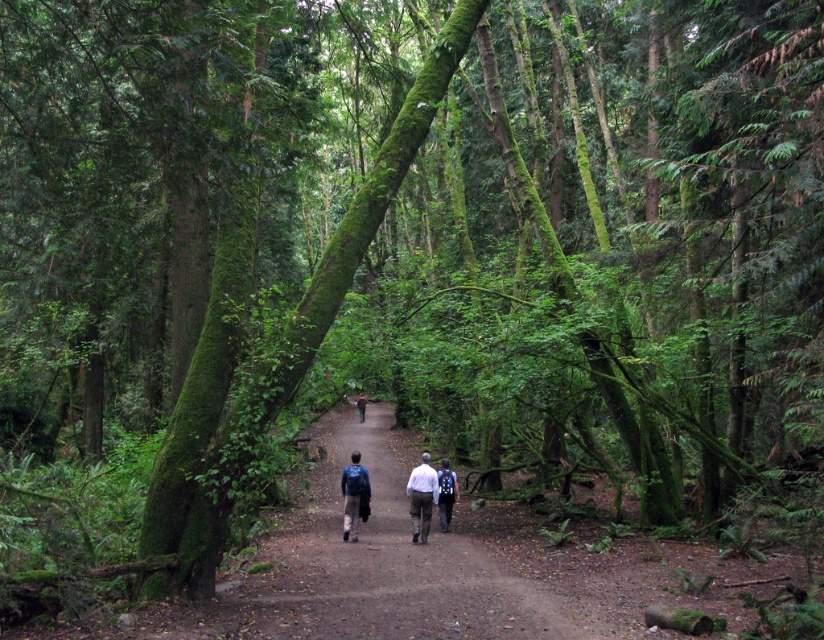
Question: Which point appears farthest from the camera in this image?

Choices:
 (A) (471, 595)
 (B) (356, 502)
 (C) (414, 490)
 (D) (457, 499)

Answer: (D)

Question: Which point is closer to the camera?

Choices:
 (A) (361, 490)
 (B) (445, 516)

Answer: (A)

Question: Which of the following is the farthest from the observer?

Choices:
 (A) blue backpack at center
 (B) matte blue backpack at center
 (C) light gray fabric backpack at center

Answer: (A)

Question: Is light gray fabric backpack at center smaller than matte blue backpack at center?

Choices:
 (A) no
 (B) yes

Answer: (B)

Question: Can you confirm if dirt path at center is positioned to the right of light gray fabric backpack at center?

Choices:
 (A) no
 (B) yes

Answer: (A)

Question: Is light gray fabric backpack at center positioned before blue backpack at center?

Choices:
 (A) yes
 (B) no

Answer: (A)